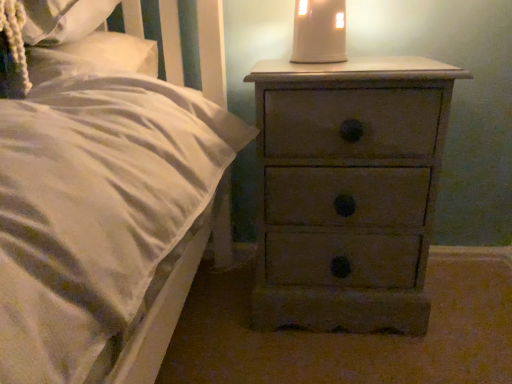
Identify the location of vacant region in front of distressed wood chest of drawers at right. The height and width of the screenshot is (384, 512). (353, 364).